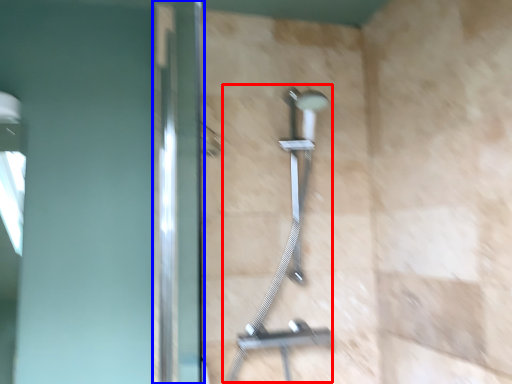
Question: Which point is further to the camera, shower (highlighted by a red box) or screen door (highlighted by a blue box)?

Choices:
 (A) shower
 (B) screen door

Answer: (A)